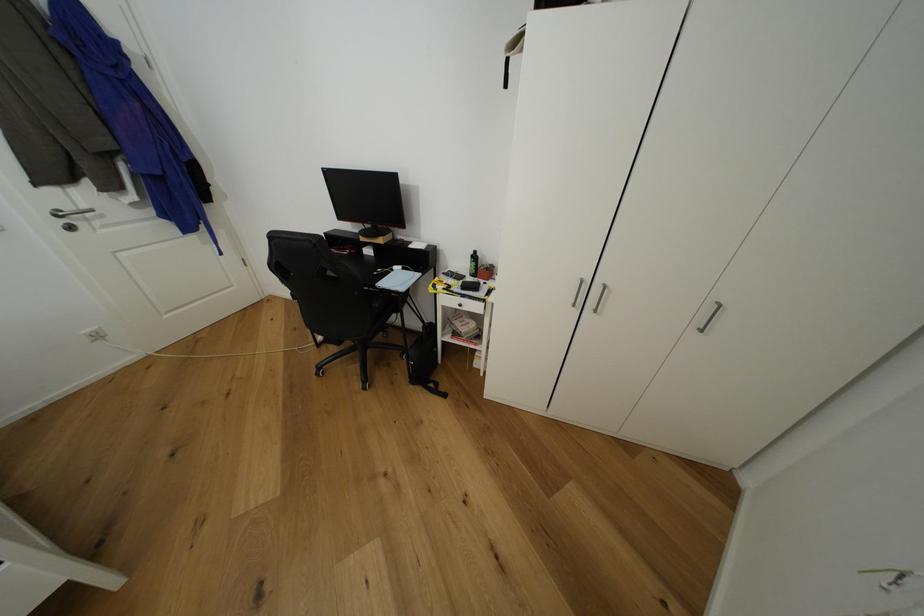
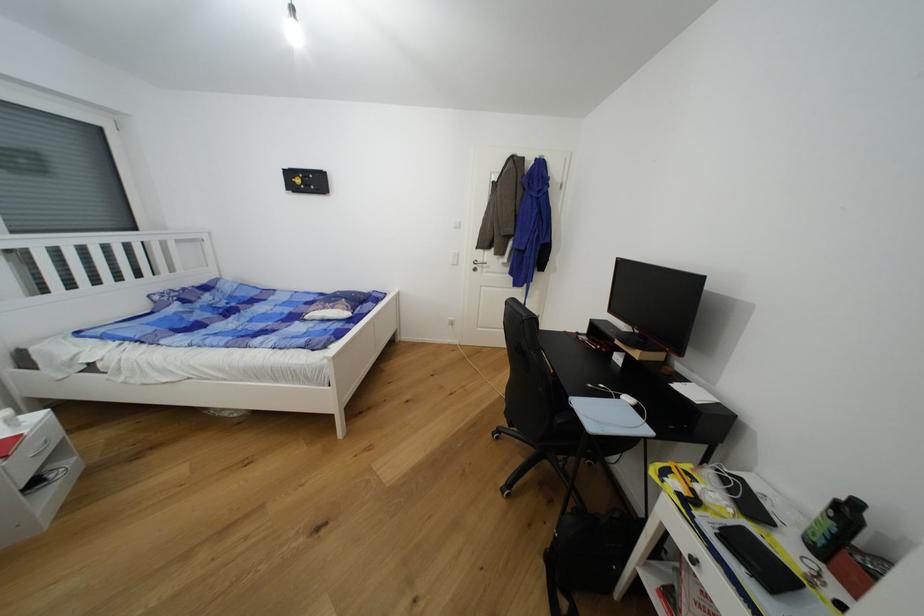
In the second image, find the point that corresponds to point 480,254 in the first image.

(862, 506)